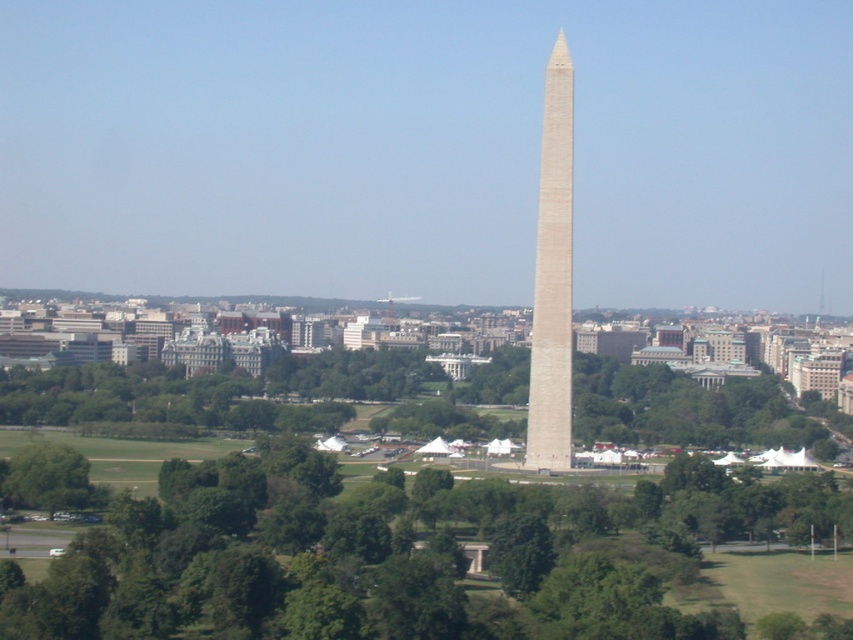
Who is lower down, beige stone obelisk at center or green leafy tree at lower left?

green leafy tree at lower left is below.

Which is more to the right, beige stone obelisk at center or green leafy tree at lower left?

beige stone obelisk at center is more to the right.

Does point (556, 241) lie in front of point (85, 472)?

Yes, point (556, 241) is in front of point (85, 472).

Where is `beige stone obelisk at center`? This screenshot has width=853, height=640. beige stone obelisk at center is located at coordinates (552, 275).

Which of these two, green leafy tree at center or green leafy tree at lower left, stands shorter?

green leafy tree at lower left

Is green leafy tree at center taller than green leafy tree at lower left?

Correct, green leafy tree at center is much taller as green leafy tree at lower left.

Between point (782, 518) and point (80, 481), which one is positioned behind?

The point (782, 518) is behind.

At what (x,y) coordinates should I click in order to perform the action: click on green leafy tree at center. Please return your answer as a coordinate pair (x, y). The width and height of the screenshot is (853, 640). Looking at the image, I should click on point(399,554).

Describe the element at coordinates (399, 554) in the screenshot. Image resolution: width=853 pixels, height=640 pixels. I see `green leafy tree at center` at that location.

Can you confirm if green leafy tree at center is positioned to the left of beige stone obelisk at center?

Correct, you'll find green leafy tree at center to the left of beige stone obelisk at center.

Between point (456, 508) and point (550, 144), which one is positioned in front?

Positioned in front is point (456, 508).

Locate an element on the screen. The height and width of the screenshot is (640, 853). green leafy tree at center is located at coordinates (399, 554).